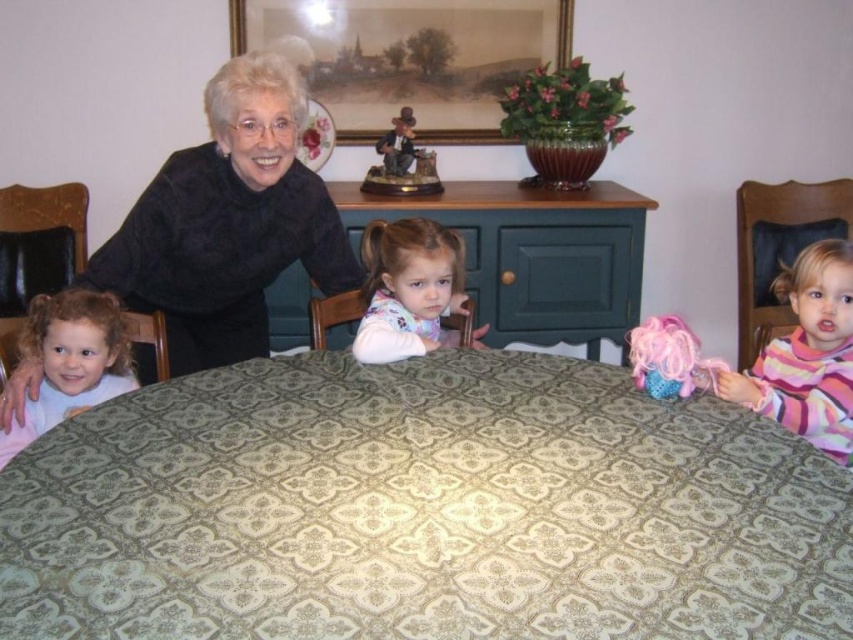
Question: Is green patterned tablecloth at center to the right of curly blonde hair at left from the viewer's perspective?

Choices:
 (A) no
 (B) yes

Answer: (B)

Question: Which of these objects is positioned closest to the matte brown figurine at upper center?

Choices:
 (A) pink fuzzy doll at lower right
 (B) green fabric table at center
 (C) pink fabric doll at right

Answer: (B)

Question: Does wooden framed picture at upper center lie in front of matte brown figurine at upper center?

Choices:
 (A) yes
 (B) no

Answer: (B)

Question: Considering the real-world distances, which object is farthest from the wooden framed picture at upper center?

Choices:
 (A) green patterned tablecloth at center
 (B) green fabric table at center

Answer: (A)

Question: Which object is closer to the camera taking this photo?

Choices:
 (A) black textured blouse at left
 (B) pink fabric doll at right

Answer: (B)

Question: Does green patterned tablecloth at center have a larger size compared to green fabric table at center?

Choices:
 (A) yes
 (B) no

Answer: (B)